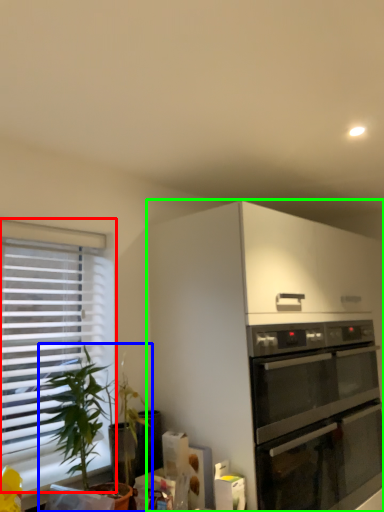
Question: Based on their relative distances, which object is farther from window (highlighted by a red box)? Choose from houseplant (highlighted by a blue box) and cabinetry (highlighted by a green box).

Choices:
 (A) houseplant
 (B) cabinetry

Answer: (B)